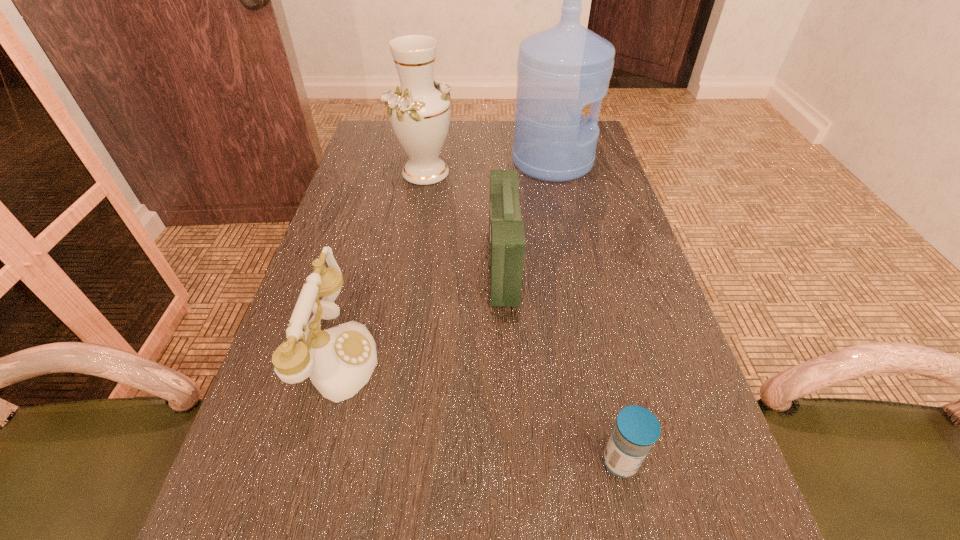
The width and height of the screenshot is (960, 540). Find the location of `water jug`. water jug is located at coordinates (561, 69).

You are a GUI agent. You are given a task and a screenshot of the screen. Output one action in this format:
    pyautogui.click(x=<x>, y=<y>)
    Task: Click on the vase
    The height and width of the screenshot is (540, 960).
    Given the screenshot: What is the action you would take?
    pyautogui.click(x=419, y=111)

Identify the location of the third object from left to right. (507, 243).

Locate an element on the screen. This screenshot has height=540, width=960. telephone is located at coordinates (340, 360).

Where is `the shortest object`? Image resolution: width=960 pixels, height=540 pixels. the shortest object is located at coordinates (637, 429).

Find the location of a particular element. Image resolution: width=960 pixels, height=540 pixels. the nearest object is located at coordinates (637, 429).

Locate an element on the screen. Image resolution: width=960 pixels, height=540 pixels. vacant space located on the right of the second tallest object is located at coordinates [x=568, y=172].

Locate an element on the screen. free region located on the front-facing side of the third object from right to left is located at coordinates (349, 266).

This screenshot has height=540, width=960. I want to click on free space located 0.260m on the front-facing side of the third object from right to left, so click(376, 266).

You are a GUI agent. You are given a task and a screenshot of the screen. Output one action in this format:
    pyautogui.click(x=<x>, y=<y>)
    Task: Click on the vacant region located 0.110m on the front-facing side of the third object from right to left
    
    Given the screenshot: What is the action you would take?
    pyautogui.click(x=442, y=266)